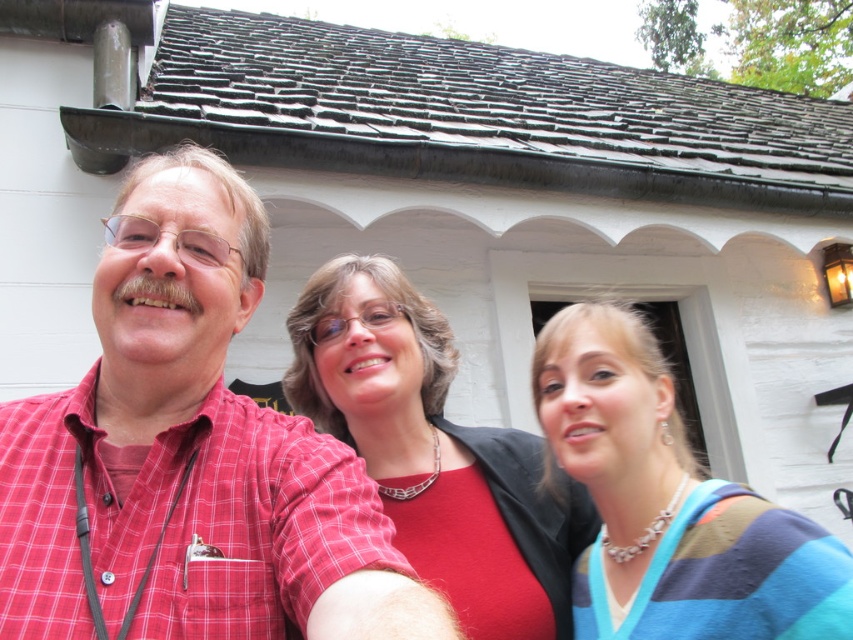
Is red checkered shirt at center above matte red blouse at center?

Yes.

Does point (12, 433) lie in front of point (442, 342)?

Yes, point (12, 433) is in front of point (442, 342).

The image size is (853, 640). What do you see at coordinates (190, 454) in the screenshot?
I see `red checkered shirt at center` at bounding box center [190, 454].

Identify the location of red checkered shirt at center. (190, 454).

Describe the element at coordinates (670, 504) in the screenshot. This screenshot has height=640, width=853. I see `striped sweater at center` at that location.

Is point (635, 403) positioned behind point (393, 273)?

No, (635, 403) is in front of (393, 273).

Between point (589, 596) and point (316, 333), which one is positioned in front?

Point (589, 596)

At what (x,y) coordinates should I click in order to perform the action: click on striped sweater at center. Please return your answer as a coordinate pair (x, y). This screenshot has width=853, height=640. Looking at the image, I should click on (670, 504).

Is point (259, 296) behind point (705, 570)?

No.

Does red checkered shirt at center have a larger size compared to striped sweater at center?

Yes, red checkered shirt at center is bigger than striped sweater at center.

Which is in front, point (303, 534) or point (645, 410)?

Positioned in front is point (303, 534).

Image resolution: width=853 pixels, height=640 pixels. In order to click on red checkered shirt at center in this screenshot , I will do `click(190, 454)`.